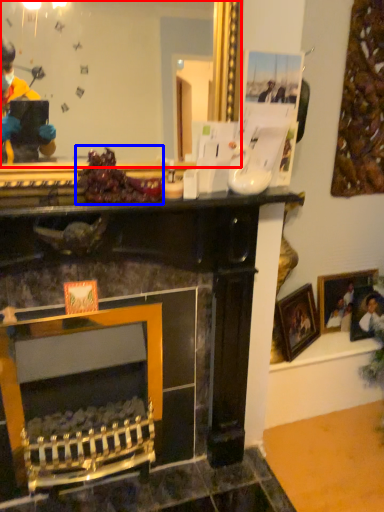
Question: Among these objects, which one is farthest to the camera, mirror (highlighted by a red box) or food (highlighted by a blue box)?

Choices:
 (A) mirror
 (B) food

Answer: (B)